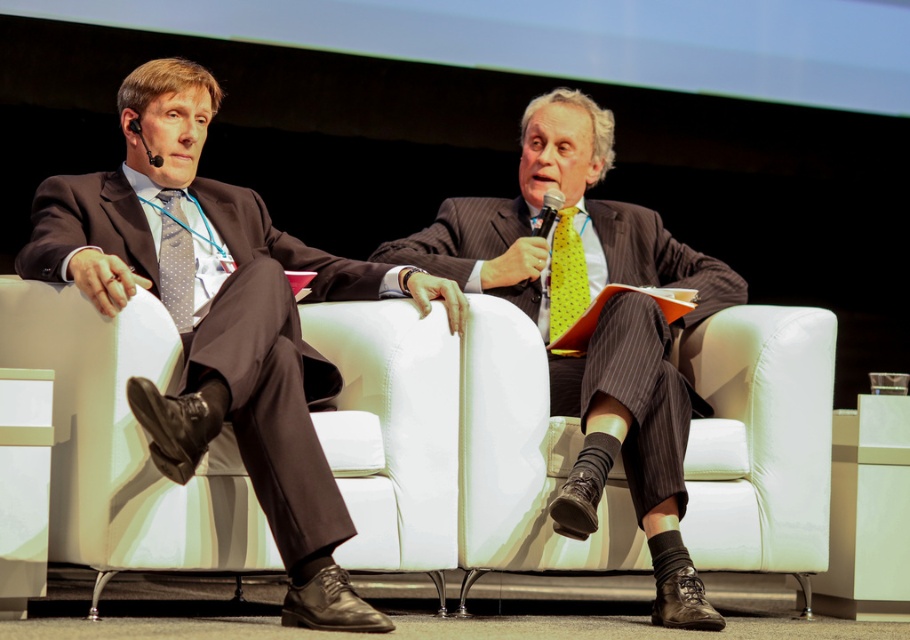
You are a photographer setting up for a formal event. You need to position a spotlight so it shines on both the matte black suit at left and the yellow dotted fabric tie at center. Based on their positions, which object should be placed higher to ensure both are illuminated properly?

The yellow dotted fabric tie at center should be placed higher since the matte black suit at left is located below it, allowing the spotlight to reach both effectively.